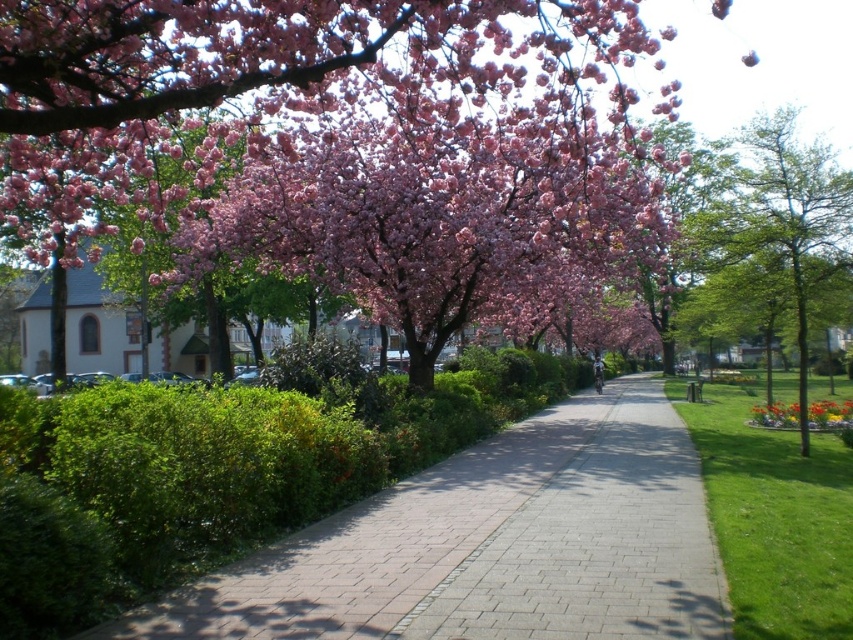
Between smooth concrete pavement at center and pink blossoms at upper center, which one has more height?

With more height is pink blossoms at upper center.

Who is lower down, smooth concrete pavement at center or pink blossoms at upper center?

smooth concrete pavement at center

Does point (624, 419) come closer to viewer compared to point (287, 24)?

No.

Where is `smooth concrete pavement at center`? smooth concrete pavement at center is located at coordinates (491, 545).

Is green leafy tree at right wider than vibrant yellow flower at lower right?

Correct, the width of green leafy tree at right exceeds that of vibrant yellow flower at lower right.

Does green leafy tree at right appear on the left side of vibrant yellow flower at lower right?

In fact, green leafy tree at right is to the right of vibrant yellow flower at lower right.

Between point (746, 314) and point (769, 420), which one is positioned in front?

Point (746, 314) is more forward.

Where is `green leafy tree at right`? green leafy tree at right is located at coordinates (775, 246).

Is smooth concrete pavement at center thinner than green leafy tree at right?

Yes, smooth concrete pavement at center is thinner than green leafy tree at right.

This screenshot has width=853, height=640. Identify the location of smooth concrete pavement at center. (491, 545).